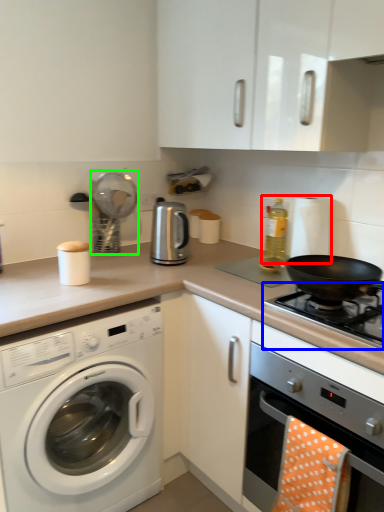
Question: Considering the real-world distances, which object is farthest from appliance (highlighted by a red box)? gas stove (highlighted by a blue box) or appliance (highlighted by a green box)?

Choices:
 (A) gas stove
 (B) appliance

Answer: (B)